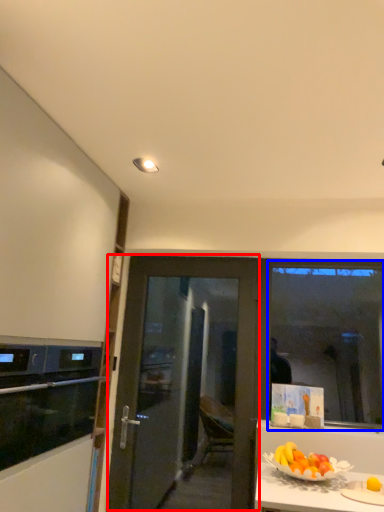
Question: Which object appears farthest to the camera in this image, door (highlighted by a red box) or window screen (highlighted by a blue box)?

Choices:
 (A) door
 (B) window screen

Answer: (B)